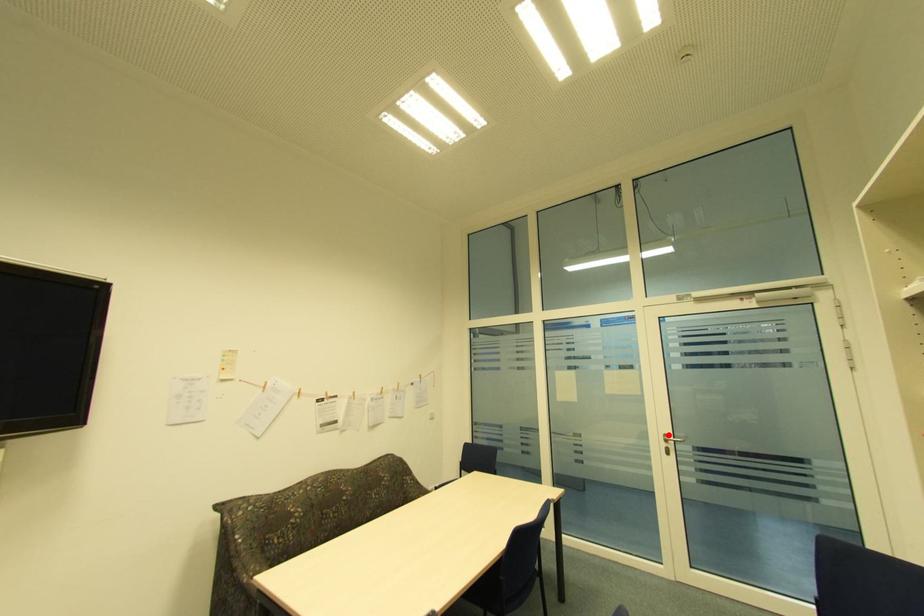
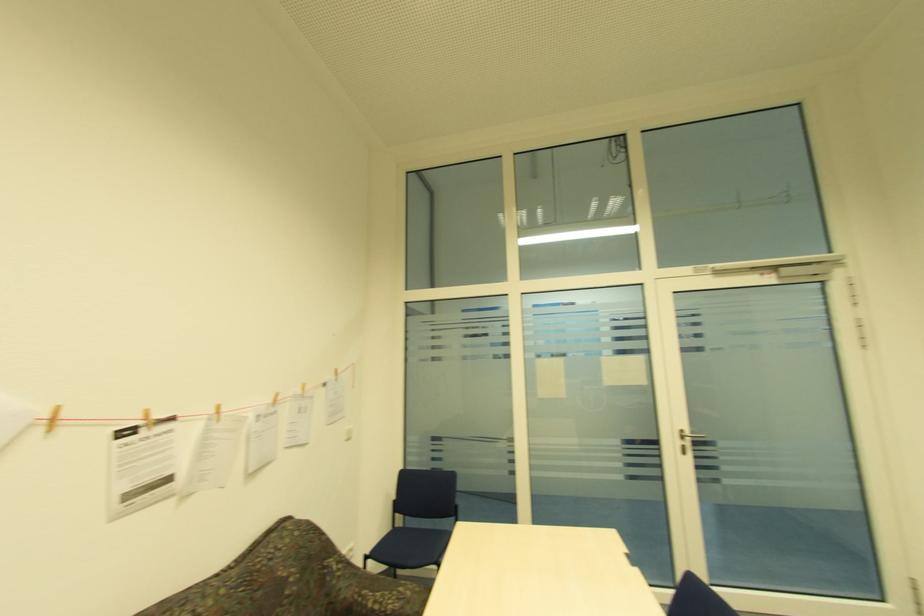
Question: I am providing you with two images of the same scene from different viewpoints. Image1 has a red point marked. In image2, the corresponding 3D location appears at what relative position? Reply with the corresponding letter.

Choices:
 (A) Closer
 (B) Farther

Answer: (B)